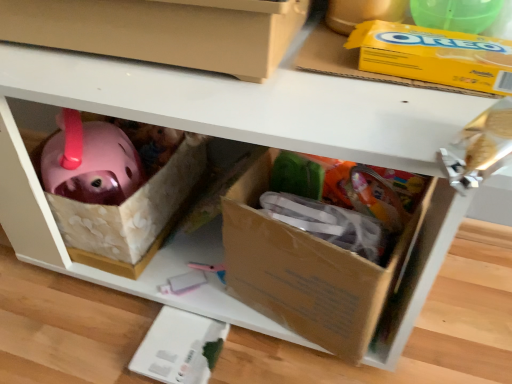
Question: Should I look upward or downward to see yellow cardboard box at upper right?

Choices:
 (A) down
 (B) up

Answer: (B)

Question: From a real-world perspective, is matte cardboard box at center, which ranks as the 2th box in bottom-to-top order, positioned under yellow cardboard box at upper right based on gravity?

Choices:
 (A) yes
 (B) no

Answer: (B)

Question: Is matte cardboard box at center, arranged as the first box when viewed from the top, positioned in front of yellow cardboard box at upper right?

Choices:
 (A) yes
 (B) no

Answer: (A)

Question: Considering the relative positions of matte cardboard box at center, which ranks as the 2th box in bottom-to-top order, and yellow cardboard box at upper right in the image provided, is matte cardboard box at center, which ranks as the 2th box in bottom-to-top order, to the left of yellow cardboard box at upper right from the viewer's perspective?

Choices:
 (A) yes
 (B) no

Answer: (A)

Question: Would you say matte cardboard box at center, which ranks as the 2th box in bottom-to-top order, is outside yellow cardboard box at upper right?

Choices:
 (A) no
 (B) yes

Answer: (B)

Question: Is matte cardboard box at center, which ranks as the 2th box in bottom-to-top order, facing towards yellow cardboard box at upper right?

Choices:
 (A) no
 (B) yes

Answer: (A)

Question: Considering the relative sizes of matte cardboard box at center, which ranks as the 2th box in bottom-to-top order, and yellow cardboard box at upper right in the image provided, is matte cardboard box at center, which ranks as the 2th box in bottom-to-top order, wider than yellow cardboard box at upper right?

Choices:
 (A) yes
 (B) no

Answer: (A)

Question: From a real-world perspective, is cardboard box at lower right, the first box from the bottom, physically below matte cardboard box at center, which ranks as the 2th box in bottom-to-top order?

Choices:
 (A) no
 (B) yes

Answer: (B)

Question: Is cardboard box at lower right, the second box when ordered from top to bottom, turned away from matte cardboard box at center, arranged as the first box when viewed from the top?

Choices:
 (A) no
 (B) yes

Answer: (A)

Question: Considering the relative sizes of cardboard box at lower right, the first box from the bottom, and matte cardboard box at center, arranged as the first box when viewed from the top, in the image provided, is cardboard box at lower right, the first box from the bottom, smaller than matte cardboard box at center, arranged as the first box when viewed from the top,?

Choices:
 (A) yes
 (B) no

Answer: (A)

Question: Could you tell me if cardboard box at lower right, the second box when ordered from top to bottom, is facing matte cardboard box at center, which ranks as the 2th box in bottom-to-top order?

Choices:
 (A) no
 (B) yes

Answer: (A)

Question: Can you confirm if cardboard box at lower right, the first box from the bottom, is positioned to the right of matte cardboard box at center, which ranks as the 2th box in bottom-to-top order?

Choices:
 (A) no
 (B) yes

Answer: (B)

Question: Is matte cardboard box at center, arranged as the first box when viewed from the top, located within cardboard box at lower right, the second box when ordered from top to bottom?

Choices:
 (A) no
 (B) yes

Answer: (A)

Question: Would you say yellow cardboard box at upper right contains matte cardboard box at center, arranged as the first box when viewed from the top?

Choices:
 (A) yes
 (B) no

Answer: (B)